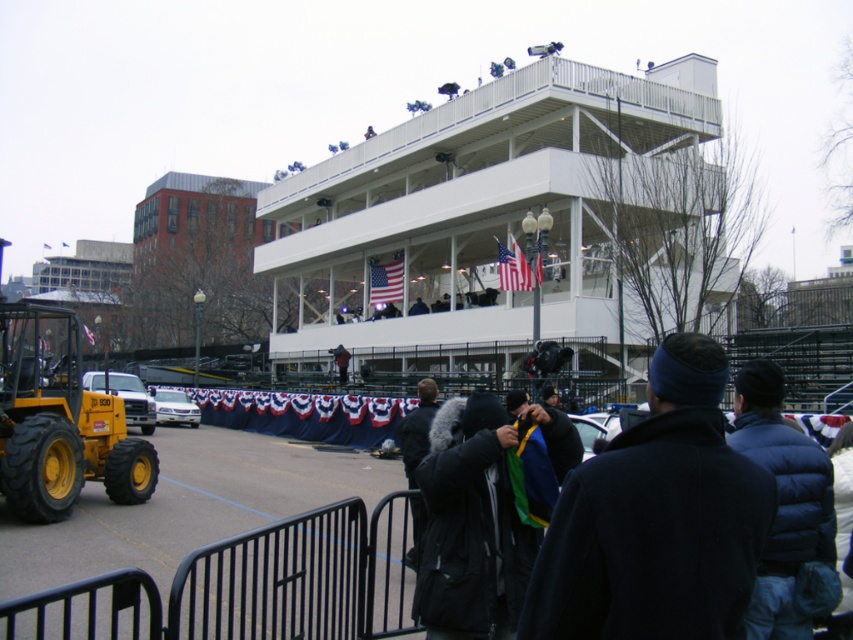
Question: Considering the relative positions of yellow rubber tractor at lower left and black fur-lined coat at center in the image provided, where is yellow rubber tractor at lower left located with respect to black fur-lined coat at center?

Choices:
 (A) below
 (B) above

Answer: (B)

Question: Which object appears closest to the camera in this image?

Choices:
 (A) yellow rubber tractor at lower left
 (B) dark blue puffer jacket at lower right
 (C) black fur-lined coat at center
 (D) dark blue fleece jacket at center

Answer: (D)

Question: Is dark blue puffer jacket at lower right to the left of black fur-lined coat at center from the viewer's perspective?

Choices:
 (A) no
 (B) yes

Answer: (A)

Question: Can you confirm if dark blue fleece jacket at center is positioned above black fur-lined coat at center?

Choices:
 (A) yes
 (B) no

Answer: (A)

Question: Which point appears closest to the camera in this image?

Choices:
 (A) (564, 584)
 (B) (49, 442)
 (C) (422, 419)

Answer: (A)

Question: Which is farther from the dark blue fleece jacket at center?

Choices:
 (A) black fur-lined coat at center
 (B) yellow rubber tractor at lower left
 (C) dark blue puffer jacket at lower right

Answer: (B)